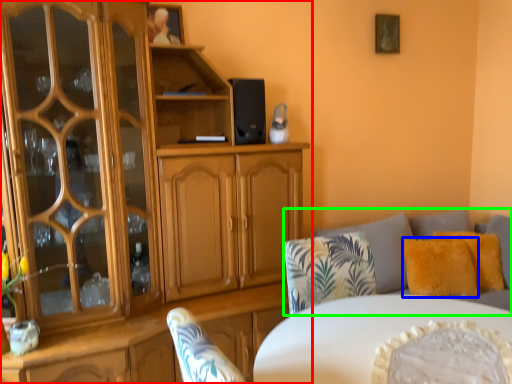
Question: Estimate the real-world distances between objects in this image. Which object is farther from cabinetry (highlighted by a red box), pillow (highlighted by a blue box) or studio couch (highlighted by a green box)?

Choices:
 (A) pillow
 (B) studio couch

Answer: (A)